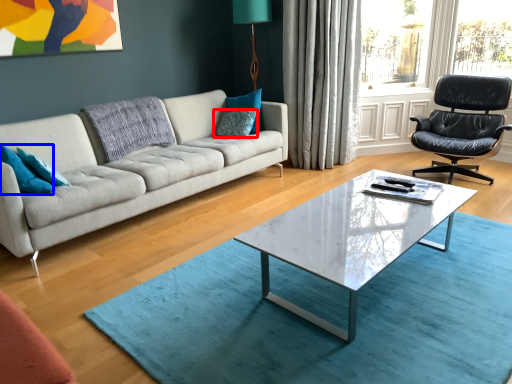
Question: Which object is further to the camera taking this photo, pillow (highlighted by a red box) or pillow (highlighted by a blue box)?

Choices:
 (A) pillow
 (B) pillow

Answer: (A)